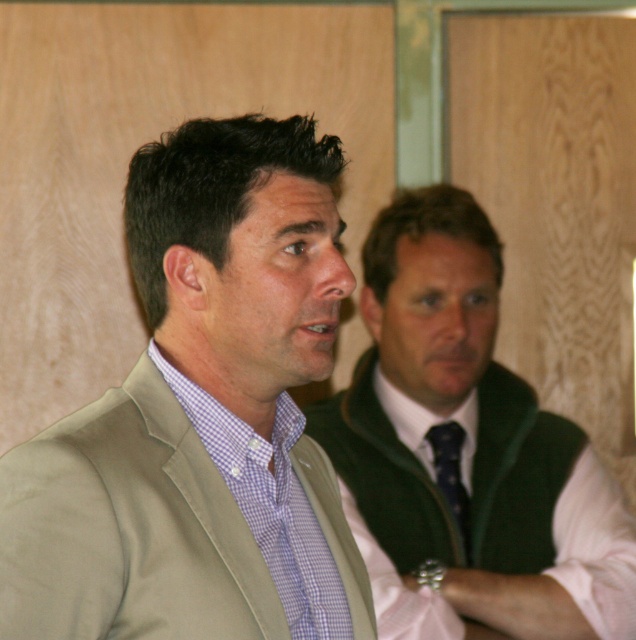
You are standing in the room and want to move from the point at coordinates point (x=254, y=196) to the point at coordinates point (x=434, y=460). Which direction should you move relative to the camera?

Since point (x=254, y=196) is closer to the camera than point (x=434, y=460), you should move away from the camera to reach point (x=434, y=460).

Based on the photo, you are a tailor who needs to adjust the size of the light beige fabric jacket at center and the dark blue silk tie at center. Which item requires more fabric to enlarge further?

The light beige fabric jacket at center requires more fabric to enlarge further since it is already bigger than the dark blue silk tie at center.

You are at a formal event and need to adjust your clothing. You see the light beige fabric jacket at center and the dark blue silk tie at center. Which one is positioned more to the left side?

The light beige fabric jacket at center is positioned to the left of the dark blue silk tie at center, so it is more to the left side.